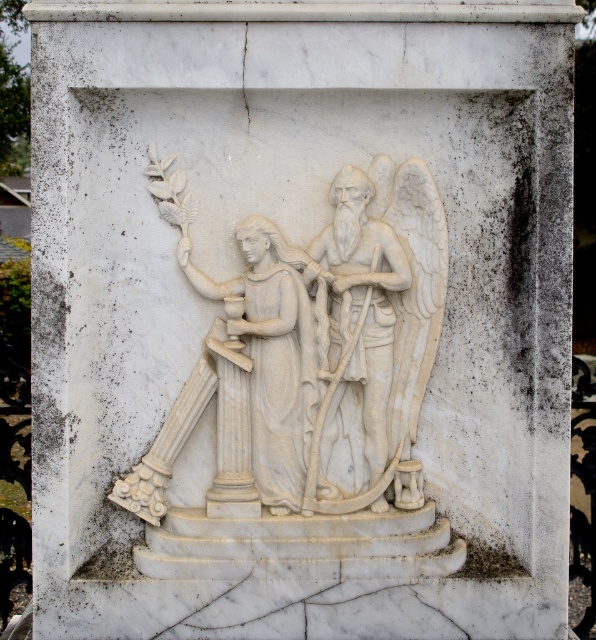
You are an art student standing in front of the sculpture and statue. You want to take a photo of both the white marble sculpture at center and the white marble statue at left. Which one will appear larger in your photo?

The white marble sculpture at center will appear larger in your photo because it is closer to you than the white marble statue at left.

You are an art conservator examining the sculpture. You notice that the white marble angel at center and the white marble statue at left are positioned in a specific way. Which one is higher up in the relief?

The white marble angel at center is higher up in the relief than the white marble statue at left because it is positioned above it.